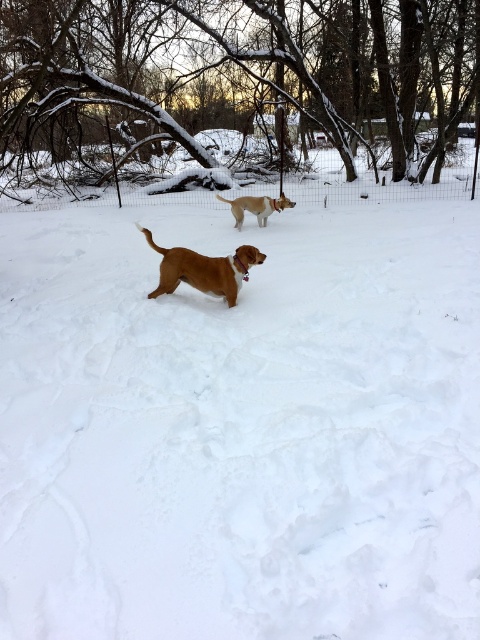
Looking at this image, does brown matte dog at center have a lesser height compared to brown fur dog at center?

No.

Between point (261, 253) and point (231, 204), which one is positioned in front?

Point (261, 253)

Where is `brown matte dog at center`? This screenshot has height=640, width=480. brown matte dog at center is located at coordinates (204, 269).